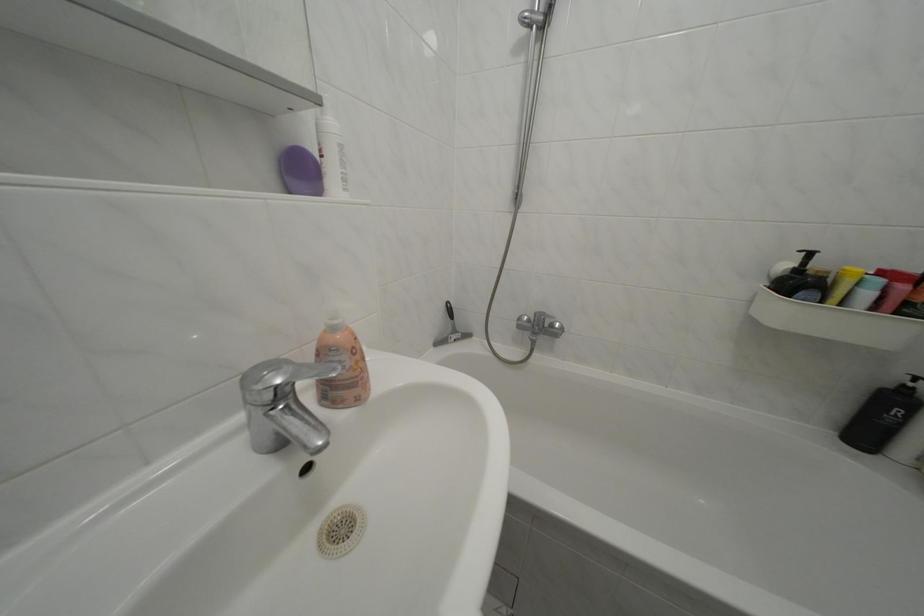
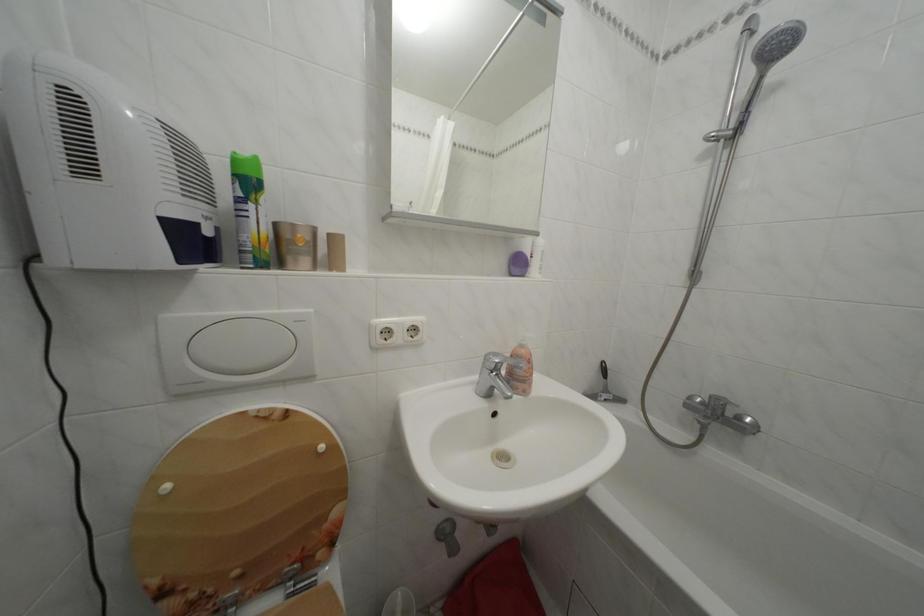
The point at (464, 338) is marked in the first image. Where is the corresponding point in the second image?

(614, 397)